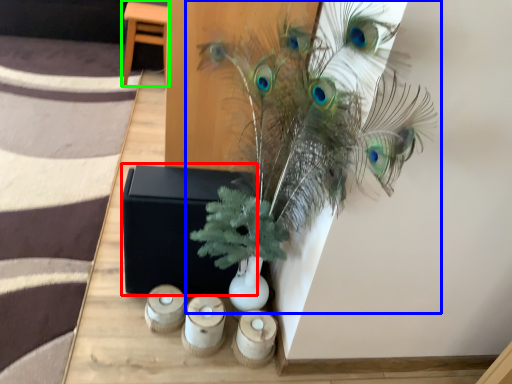
Question: Estimate the real-world distances between objects in this image. Which object is farther from box (highlighted by a red box), houseplant (highlighted by a blue box) or furniture (highlighted by a green box)?

Choices:
 (A) houseplant
 (B) furniture

Answer: (B)